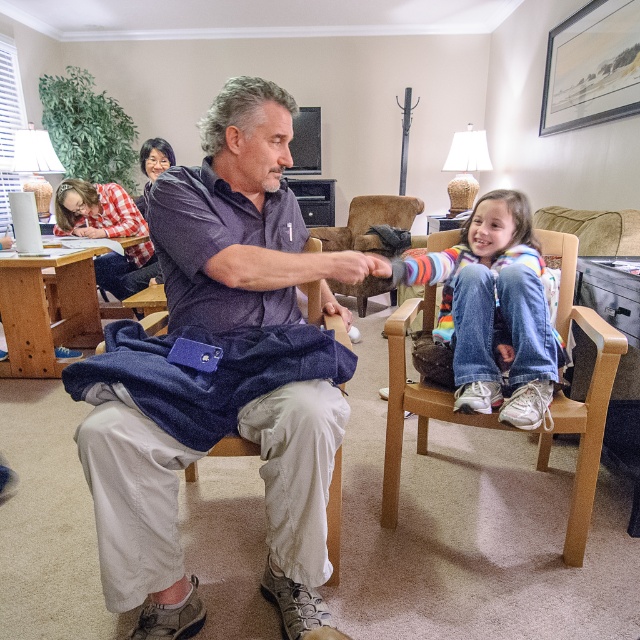
Question: Does matte blue shirt at center lie in front of khaki fabric armchair at center?

Choices:
 (A) yes
 (B) no

Answer: (A)

Question: Among these objects, which one is farthest from the camera?

Choices:
 (A) denim fabric at lower right
 (B) khaki fabric armchair at center

Answer: (A)

Question: Is jeans at lower right closer to camera compared to khaki fabric armchair at center?

Choices:
 (A) no
 (B) yes

Answer: (A)

Question: Is matte blue shirt at center wider than khaki fabric armchair at center?

Choices:
 (A) yes
 (B) no

Answer: (A)

Question: Which point appears farthest from the camera in this image?

Choices:
 (A) (112, 502)
 (B) (532, 336)
 (C) (433, 388)
 (D) (308, 317)

Answer: (D)

Question: Which object appears closest to the camera in this image?

Choices:
 (A) jeans at lower right
 (B) matte blue shirt at center

Answer: (B)